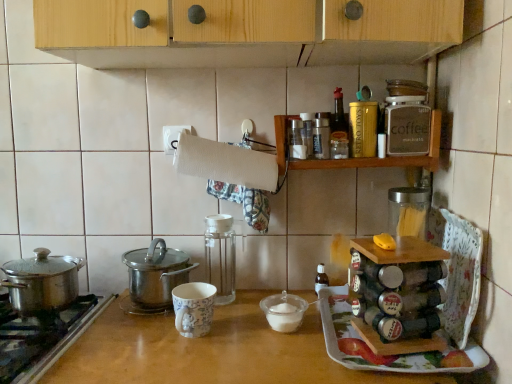
Question: From the image's perspective, is metallic glass spice rack at upper center, which is counted as the 4th kitchen appliance, starting from the right, above or below white plastic bowl at center, the 1th appliance viewed from the left?

Choices:
 (A) below
 (B) above

Answer: (B)

Question: Looking at the image, does metallic glass spice rack at upper center, which is counted as the 4th kitchen appliance, starting from the right, seem bigger or smaller compared to white plastic bowl at center, the 2th appliance positioned from the right?

Choices:
 (A) small
 (B) big

Answer: (A)

Question: Which object is positioned farthest from the transparent glass spice rack at center, which is the 5th kitchen appliance in right-to-left order?

Choices:
 (A) white plastic bowl at center, the 2th appliance positioned from the right
 (B) metallic glass spice rack at upper center, which ranks as the 4th kitchen appliance in left-to-right order
 (C) porcelain floral mug at center
 (D) wooden spice rack at upper right
 (E) shiny metallic pot at left, marked as the second kitchen appliance in a left-to-right arrangement

Answer: (B)

Question: Considering the real-world distances, which object is closest to the metallic silver spice rack at center right, which ranks as the second appliance in left-to-right order?

Choices:
 (A) metallic glass spice rack at upper center, which is counted as the 4th kitchen appliance, starting from the right
 (B) white paper towel at upper center
 (C) transparent glass spice rack at center, which is the 3th kitchen appliance from left to right
 (D) gold metallic canister at upper center, the fifth kitchen appliance when ordered from left to right
 (E) stainless steel gas stove at lower left

Answer: (D)